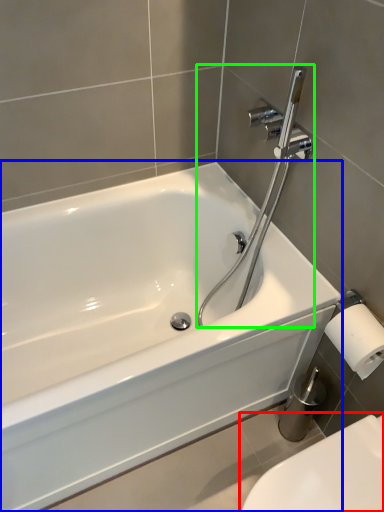
Question: Considering the real-world distances, which object is farthest from toilet (highlighted by a red box)? bathtub (highlighted by a blue box) or plumbing fixture (highlighted by a green box)?

Choices:
 (A) bathtub
 (B) plumbing fixture

Answer: (B)